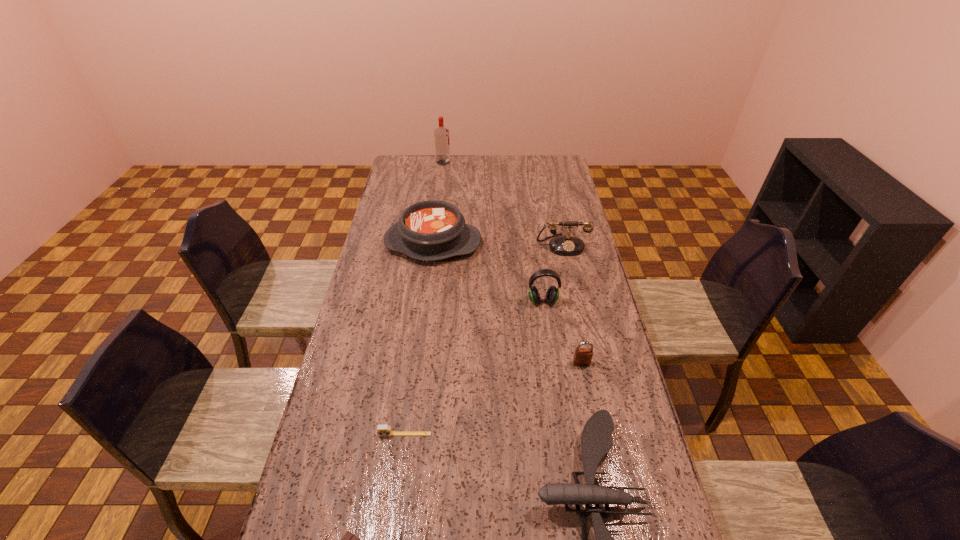
Locate an element on the screen. The width and height of the screenshot is (960, 540). vacant region located 0.200m on the dial of the telephone is located at coordinates (572, 293).

At what (x,y) coordinates should I click in order to perform the action: click on vacant space located on the front-facing side of the fifth farthest object. Please return your answer as a coordinate pair (x, y). The image size is (960, 540). Looking at the image, I should click on (606, 483).

This screenshot has width=960, height=540. In order to click on vacant space situated 0.170m at the front of the tape measure with the tape extended in this screenshot , I will do `click(396, 503)`.

I want to click on object that is at the far edge, so (441, 134).

The width and height of the screenshot is (960, 540). I want to click on casserole present at the left edge, so click(x=431, y=230).

What are the coordinates of `tape measure present at the left edge` in the screenshot? It's located at (382, 430).

I want to click on headset that is positioned at the right edge, so click(552, 295).

This screenshot has width=960, height=540. I want to click on telephone that is positioned at the right edge, so click(x=562, y=245).

Where is `padlock that is at the right edge`? The width and height of the screenshot is (960, 540). padlock that is at the right edge is located at coordinates (582, 356).

You are a GUI agent. You are given a task and a screenshot of the screen. Output one action in this format:
    pyautogui.click(x=<x>, y=<y>)
    Task: Click on the vacant point at the far edge
    
    Given the screenshot: What is the action you would take?
    pyautogui.click(x=435, y=178)